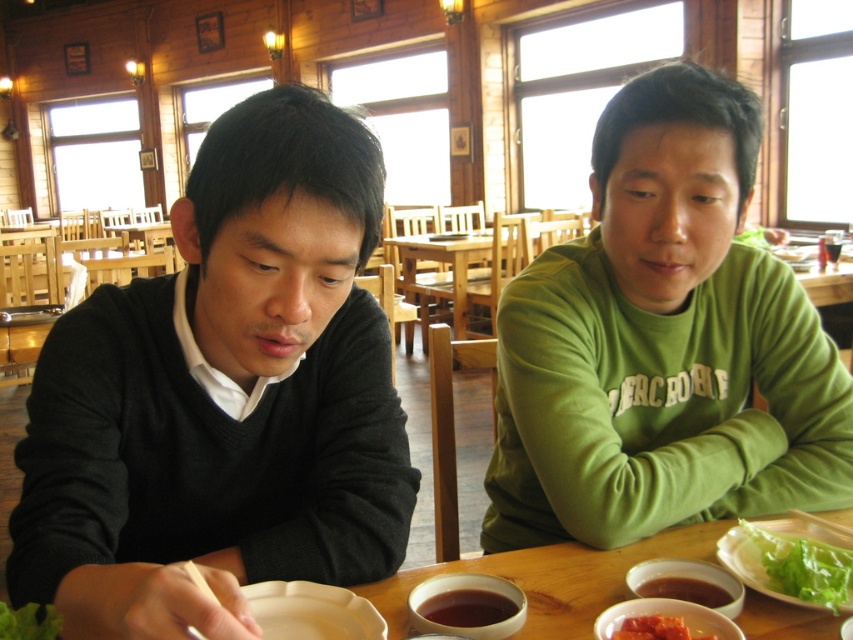
Between green leafy lettuce at lower right and smooth tomato paste at lower center, which one appears on the right side from the viewer's perspective?

From the viewer's perspective, green leafy lettuce at lower right appears more on the right side.

Is green leafy lettuce at lower right bigger than smooth tomato paste at lower center?

Correct, green leafy lettuce at lower right is larger in size than smooth tomato paste at lower center.

Is point (824, 596) positioned in front of point (656, 636)?

No, it is behind (656, 636).

At what (x,y) coordinates should I click in order to perform the action: click on green leafy lettuce at lower right. Please return your answer as a coordinate pair (x, y). This screenshot has height=640, width=853. Looking at the image, I should click on (804, 566).

Is dark gray sweater at left wider than smooth tomato paste at lower center?

Indeed, dark gray sweater at left has a greater width compared to smooth tomato paste at lower center.

Can you confirm if dark gray sweater at left is thinner than smooth tomato paste at lower center?

No, dark gray sweater at left is not thinner than smooth tomato paste at lower center.

Find the location of a particular element. dark gray sweater at left is located at coordinates (223, 396).

This screenshot has height=640, width=853. Identify the location of dark gray sweater at left. (223, 396).

Between dark gray sweater at left and green matte shirt at center, which one is positioned higher?

green matte shirt at center is higher up.

Can you confirm if dark gray sweater at left is bigger than green matte shirt at center?

Actually, dark gray sweater at left might be smaller than green matte shirt at center.

Between point (30, 444) and point (676, 524), which one is positioned behind?

Point (676, 524)

This screenshot has width=853, height=640. Find the location of `dark gray sweater at left`. dark gray sweater at left is located at coordinates (223, 396).